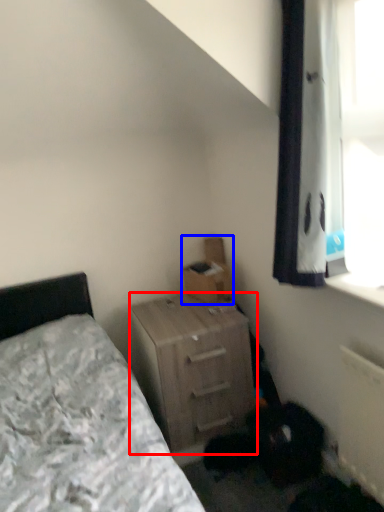
Question: Among these objects, which one is nearest to the camera, nightstand (highlighted by a red box) or cardboard box (highlighted by a blue box)?

Choices:
 (A) nightstand
 (B) cardboard box

Answer: (A)